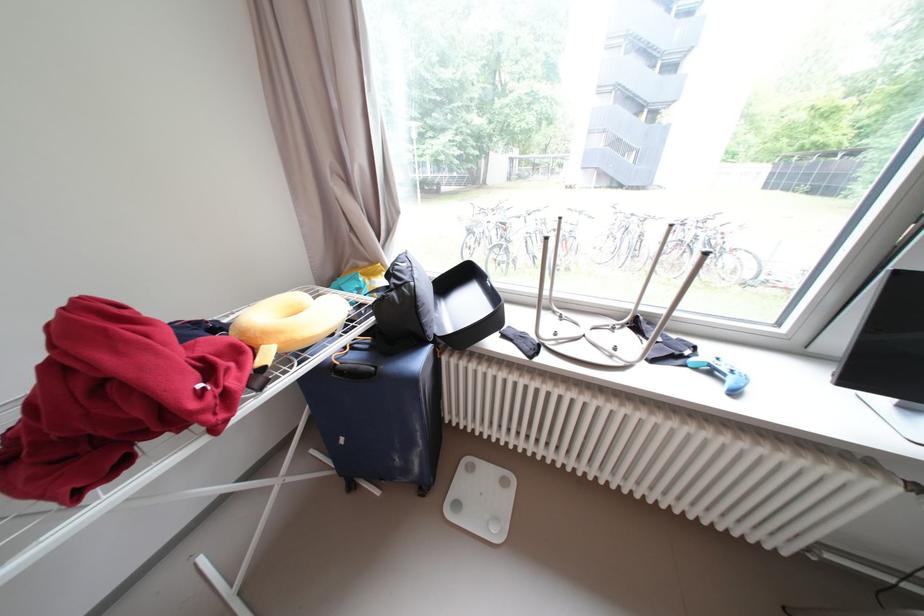
The image size is (924, 616). What do you see at coordinates (354, 371) in the screenshot?
I see `the blue suitcase handle` at bounding box center [354, 371].